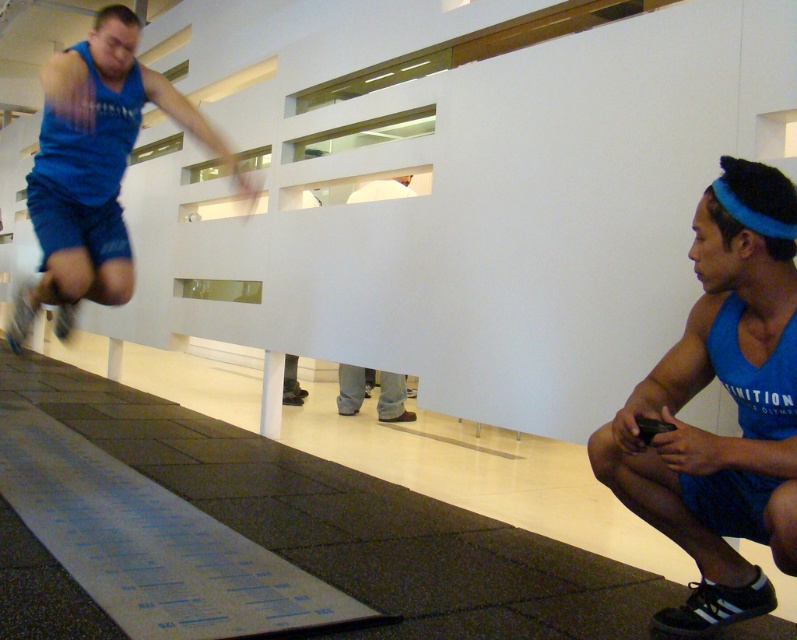
Question: Among these objects, which one is nearest to the camera?

Choices:
 (A) gray fabric pants at center
 (B) blue fabric tank top at left

Answer: (B)

Question: Which point is farther to the camera?

Choices:
 (A) (780, 442)
 (B) (101, 99)
 (C) (352, 372)

Answer: (C)

Question: Estimate the real-world distances between objects in this image. Which object is farther from the blue fabric tank top at lower right?

Choices:
 (A) gray fabric pants at center
 (B) blue fabric tank top at left

Answer: (A)

Question: Is blue fabric tank top at lower right smaller than blue fabric tank top at left?

Choices:
 (A) no
 (B) yes

Answer: (B)

Question: Is blue fabric tank top at left behind gray fabric pants at center?

Choices:
 (A) yes
 (B) no

Answer: (B)

Question: Does blue fabric tank top at lower right have a larger size compared to blue fabric tank top at left?

Choices:
 (A) no
 (B) yes

Answer: (A)